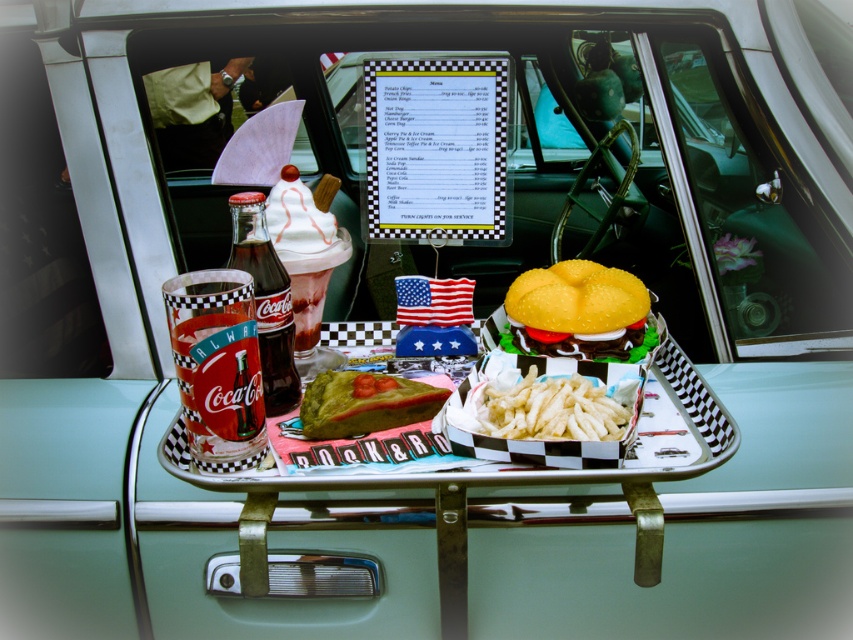
Can you confirm if dark glass coca-cola bottle at center is bigger than white crispy fries at center?

Correct, dark glass coca-cola bottle at center is larger in size than white crispy fries at center.

Does dark glass coca-cola bottle at center have a greater width compared to white crispy fries at center?

No.

This screenshot has height=640, width=853. What are the coordinates of `dark glass coca-cola bottle at center` in the screenshot? It's located at (265, 300).

Is the position of yellow sponge cake at center more distant than that of green matte cake at center?

Yes.

Does yellow sponge cake at center have a lesser width compared to green matte cake at center?

No.

Who is more distant from viewer, (x=582, y=304) or (x=369, y=384)?

Point (x=582, y=304)

Image resolution: width=853 pixels, height=640 pixels. Find the location of `yellow sponge cake at center`. yellow sponge cake at center is located at coordinates (577, 310).

Which is above, yellow sponge cake at center or white crispy fries at center?

yellow sponge cake at center is higher up.

Who is more distant from viewer, (514, 285) or (515, 417)?

Point (514, 285)

Locate an element on the screen. This screenshot has width=853, height=640. yellow sponge cake at center is located at coordinates (577, 310).